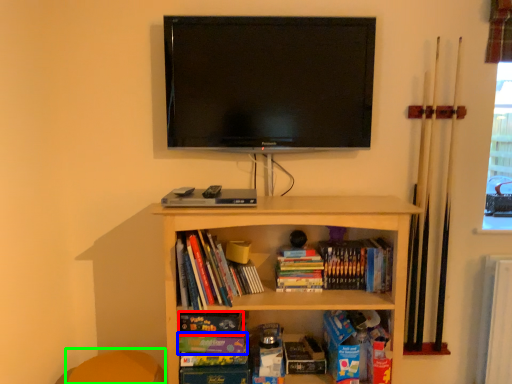
Question: Which is nearer to the paperback book (highlighted by a red box)? paperback book (highlighted by a blue box) or swivel chair (highlighted by a green box).

Choices:
 (A) paperback book
 (B) swivel chair

Answer: (A)